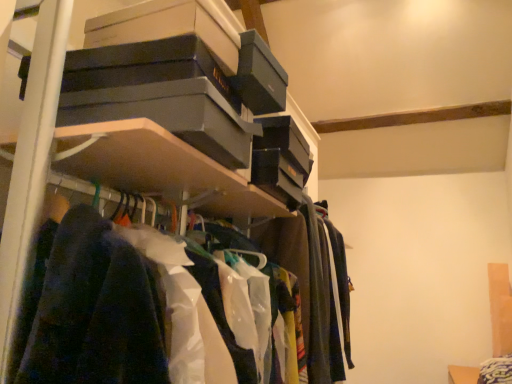
Question: Looking at their shapes, would you say polyester shirts at center is wider or thinner than matte black boxes at upper center?

Choices:
 (A) wide
 (B) thin

Answer: (B)

Question: Is point (x=116, y=372) closer or farther from the camera than point (x=13, y=336)?

Choices:
 (A) closer
 (B) farther

Answer: (A)

Question: From the image's perspective, is polyester shirts at center above or below matte black boxes at upper center?

Choices:
 (A) below
 (B) above

Answer: (B)

Question: From their relative heights in the image, would you say matte black boxes at upper center is taller or shorter than polyester shirts at center?

Choices:
 (A) tall
 (B) short

Answer: (A)

Question: Considering their positions, is matte black boxes at upper center located in front of or behind polyester shirts at center?

Choices:
 (A) behind
 (B) front

Answer: (A)

Question: Is matte black boxes at upper center to the left or to the right of polyester shirts at center in the image?

Choices:
 (A) left
 (B) right

Answer: (B)

Question: From a real-world perspective, is matte black boxes at upper center physically located above or below polyester shirts at center?

Choices:
 (A) below
 (B) above

Answer: (B)